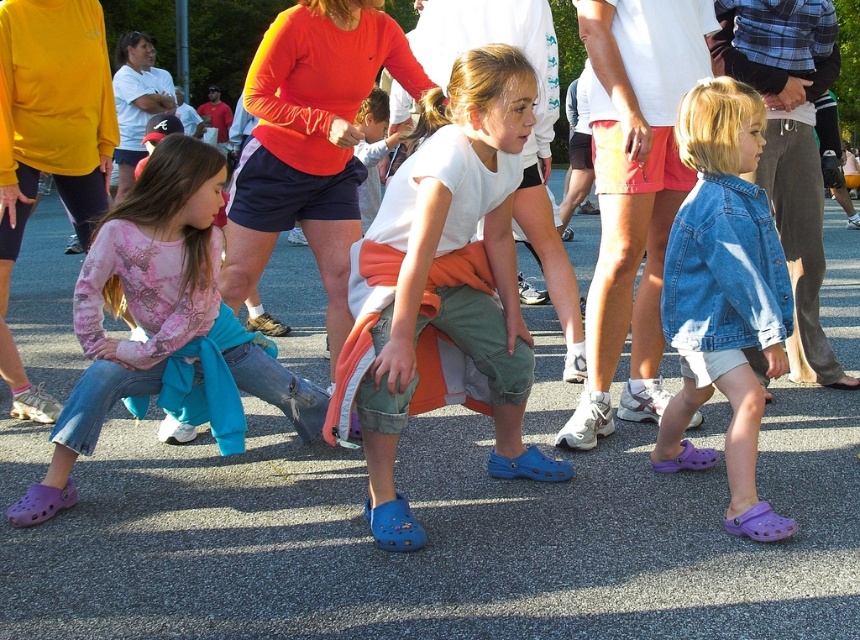
How distant is purple croc shoes at lower left from matte orange shirt at center?

32.25 inches

Can you confirm if purple croc shoes at lower left is positioned above matte orange shirt at center?

No, purple croc shoes at lower left is not above matte orange shirt at center.

Between point (53, 468) and point (244, 196), which one is positioned in front?

Point (53, 468) is more forward.

Locate an element on the screen. purple croc shoes at lower left is located at coordinates (137, 301).

Does purple croc shoes at lower left have a lesser height compared to denim shorts at center?

Correct, purple croc shoes at lower left is not as tall as denim shorts at center.

Is point (158, 200) positioned behind point (609, 54)?

No, it is not.

Find the location of a particular element. purple croc shoes at lower left is located at coordinates (137, 301).

Is denim jacket at lower right to the left of denim shorts at center from the viewer's perspective?

In fact, denim jacket at lower right is to the right of denim shorts at center.

Is denim jacket at lower right further to camera compared to denim shorts at center?

No.

Find the location of a particular element. This screenshot has width=860, height=640. denim jacket at lower right is located at coordinates (723, 296).

I want to click on denim jacket at lower right, so click(723, 296).